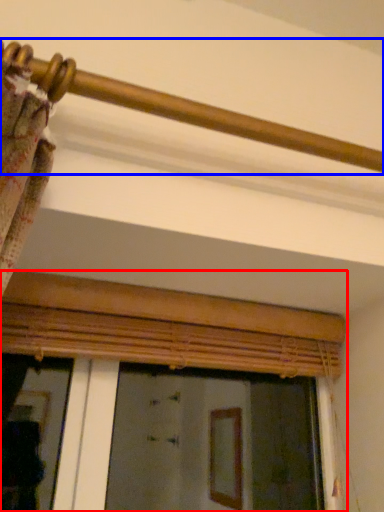
Question: Which point is further to the camera, window (highlighted by a red box) or rail (highlighted by a blue box)?

Choices:
 (A) window
 (B) rail

Answer: (A)